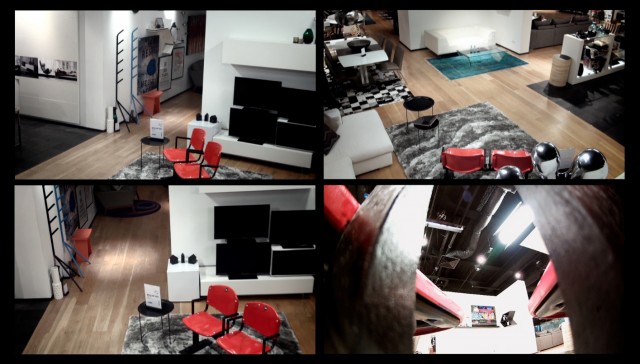
Where is `monitor`? monitor is located at coordinates (256, 121).